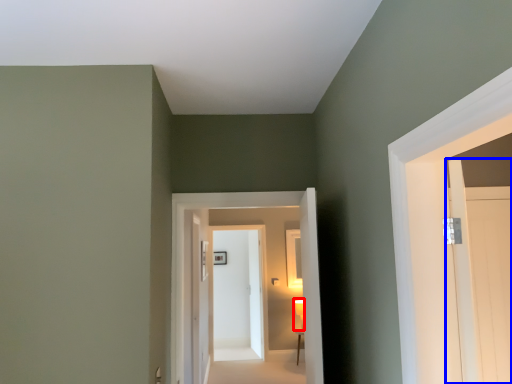
Question: Which point is further to the camera, light fixture (highlighted by a red box) or door (highlighted by a blue box)?

Choices:
 (A) light fixture
 (B) door

Answer: (A)